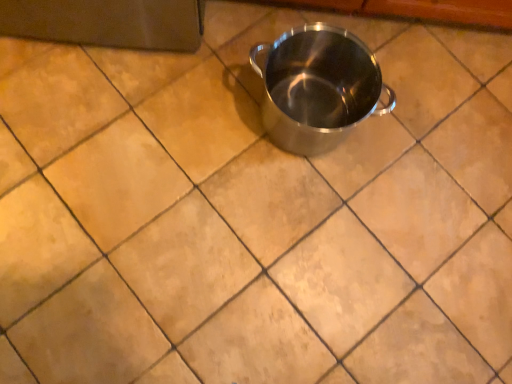
I want to click on vacant region to the right of shiny metallic pot at center, so click(x=401, y=158).